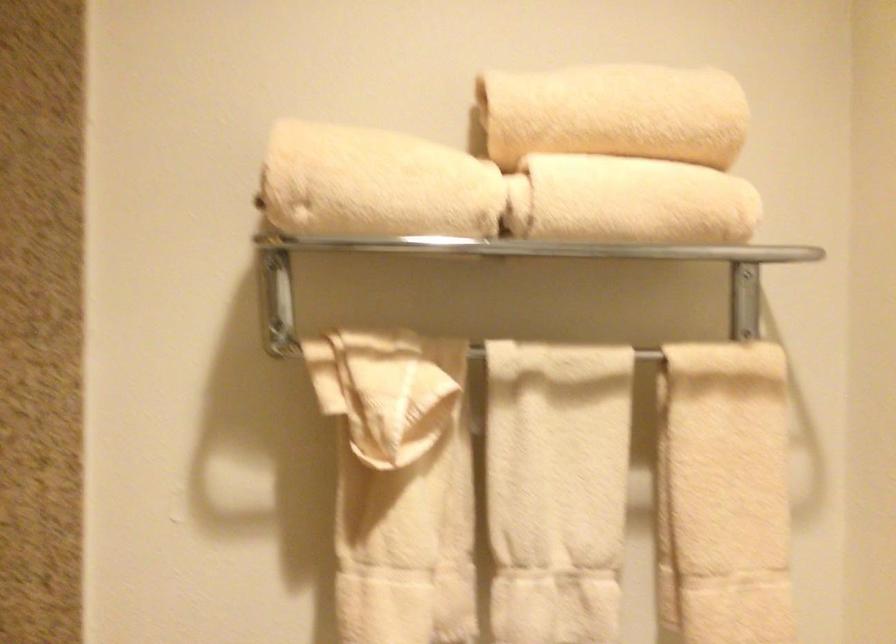
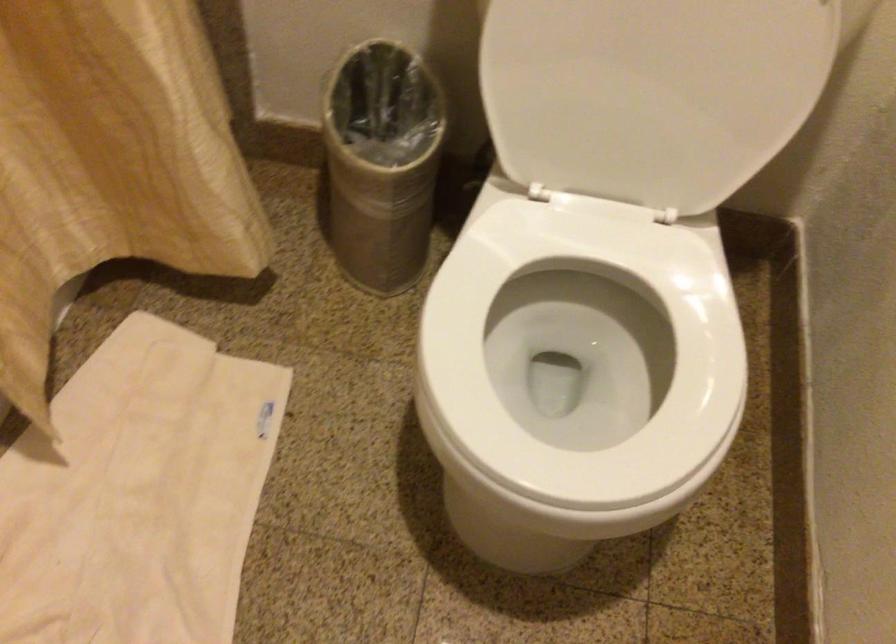
Question: The first image is from the beginning of the video and the second image is from the end. How did the camera likely rotate when shooting the video?

Choices:
 (A) Left
 (B) Right
 (C) Up
 (D) Down

Answer: (D)